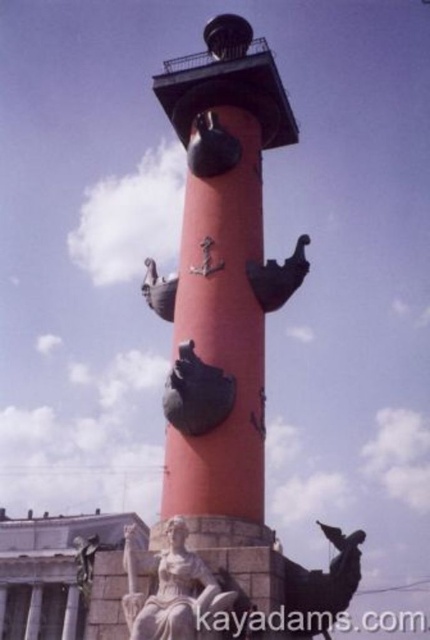
Is smooth red tower at center shorter than white marble statue at center?

No.

Measure the distance between smooth red tower at center and camera.

smooth red tower at center and camera are 159.11 feet apart from each other.

The image size is (430, 640). What are the coordinates of `smooth red tower at center` in the screenshot? It's located at (223, 273).

The height and width of the screenshot is (640, 430). What are the coordinates of `white marble statue at center` in the screenshot? It's located at (172, 589).

Does white marble statue at center have a lesser width compared to bronze statue at lower right?

Incorrect, white marble statue at center's width is not less than bronze statue at lower right's.

You are a GUI agent. You are given a task and a screenshot of the screen. Output one action in this format:
    pyautogui.click(x=<x>, y=<y>)
    Task: Click on the white marble statue at center
    Image resolution: width=430 pixels, height=640 pixels.
    Given the screenshot: What is the action you would take?
    pyautogui.click(x=172, y=589)

Between smooth red tower at center and shiny bronze bird at center, which one has less height?

With less height is shiny bronze bird at center.

The height and width of the screenshot is (640, 430). What do you see at coordinates (223, 273) in the screenshot? I see `smooth red tower at center` at bounding box center [223, 273].

Does point (221, 362) lie in front of point (196, 412)?

No.

This screenshot has width=430, height=640. Find the location of `smooth red tower at center`. smooth red tower at center is located at coordinates (223, 273).